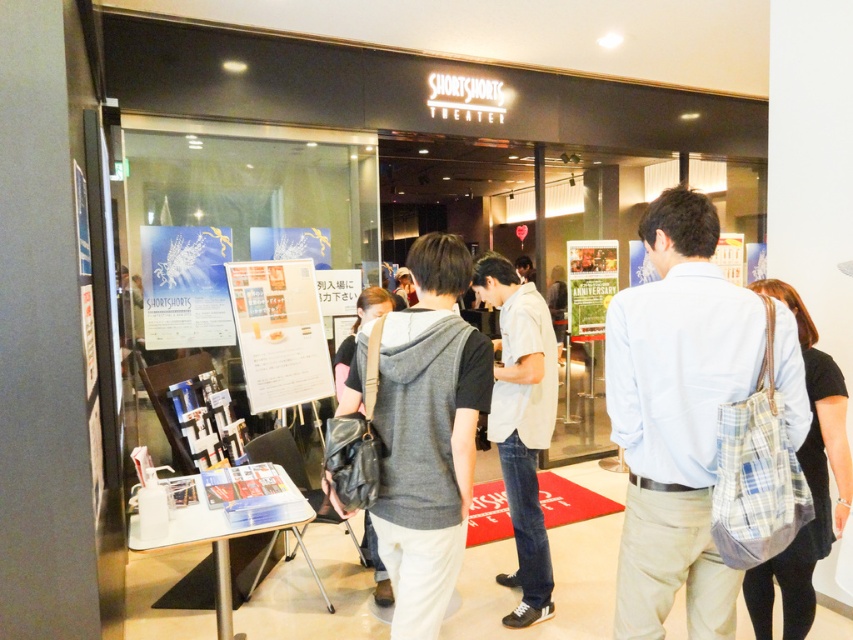
Question: Can you confirm if matte black backpack at center is wider than white paper poster at center?

Choices:
 (A) yes
 (B) no

Answer: (B)

Question: Which of the following is the farthest from the observer?

Choices:
 (A) gray hoodie at center
 (B) light blue shirt at center
 (C) white paper at center

Answer: (C)

Question: Does gray hoodie at center come behind plaid fabric bag at center?

Choices:
 (A) no
 (B) yes

Answer: (A)

Question: Which of the following is the farthest from the observer?

Choices:
 (A) light beige cotton shirt at center
 (B) green paper poster at center
 (C) matte white paper poster at left
 (D) white paper poster at center

Answer: (D)

Question: Estimate the real-world distances between objects in this image. Which object is closer to the light beige cotton shirt at center?

Choices:
 (A) white paper at center
 (B) plaid fabric bag at center
 (C) matte black backpack at center

Answer: (C)

Question: Is white paper at center above matte black backpack at center?

Choices:
 (A) yes
 (B) no

Answer: (A)